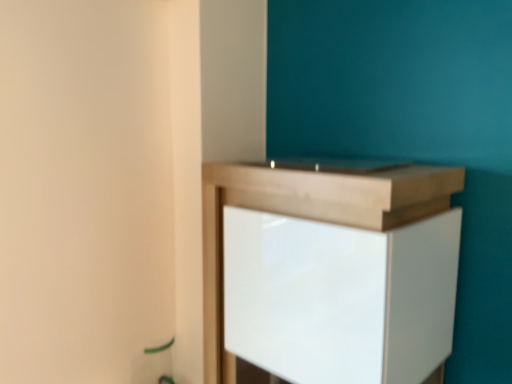
The height and width of the screenshot is (384, 512). I want to click on white glossy cabinet at upper center, so click(x=308, y=216).

The width and height of the screenshot is (512, 384). What do you see at coordinates (308, 216) in the screenshot?
I see `white glossy cabinet at upper center` at bounding box center [308, 216].

What is the approximate width of white glossy cabinet at upper center?

The width of white glossy cabinet at upper center is 18.58 inches.

The image size is (512, 384). I want to click on white glossy cabinet at upper center, so click(308, 216).